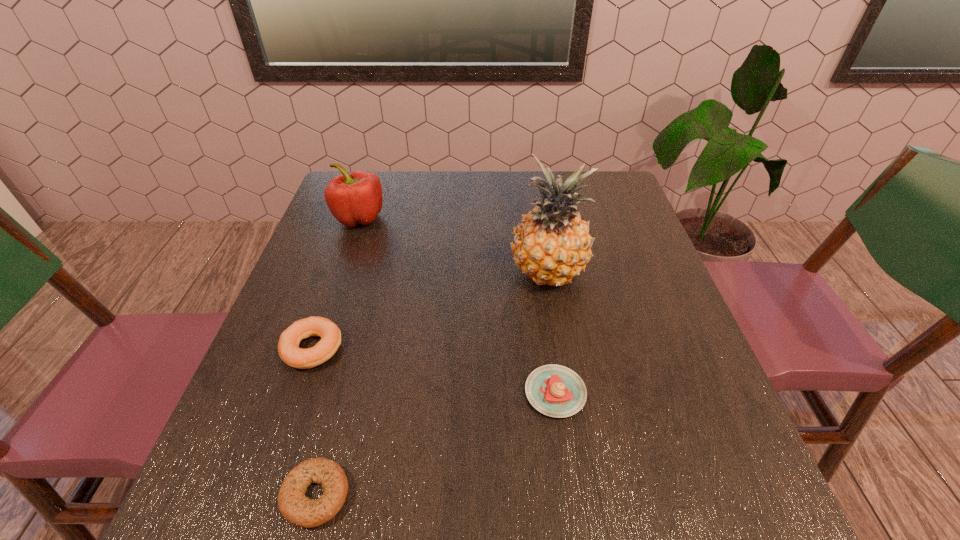
The width and height of the screenshot is (960, 540). Find the location of `free space at the near edge of the desktop`. free space at the near edge of the desktop is located at coordinates (356, 497).

I want to click on free space at the left edge, so (324, 416).

Identify the location of vacant space at the right edge. (629, 357).

The width and height of the screenshot is (960, 540). In the image, there is a desktop. Find the location of `free space at the far left corner`. free space at the far left corner is located at coordinates (375, 171).

At what (x,y) coordinates should I click in order to perform the action: click on vacant space at the near left corner. Please return your answer as a coordinate pair (x, y). Image resolution: width=960 pixels, height=540 pixels. Looking at the image, I should click on (214, 531).

Locate an element on the screen. The image size is (960, 540). blank space at the far right corner of the desktop is located at coordinates (613, 210).

What are the coordinates of `blank space at the near right corner of the desktop` in the screenshot? It's located at (685, 515).

Where is `free spot between the nearer bagel and the fourth nearest object`? This screenshot has width=960, height=540. free spot between the nearer bagel and the fourth nearest object is located at coordinates (432, 385).

At what (x,y) coordinates should I click in order to perform the action: click on free space between the farther bagel and the nearest object. Please return your answer as a coordinate pair (x, y). This screenshot has width=960, height=540. Looking at the image, I should click on (314, 422).

Locate an element on the screen. vacant area that lies between the third tallest object and the shorter bagel is located at coordinates (314, 422).